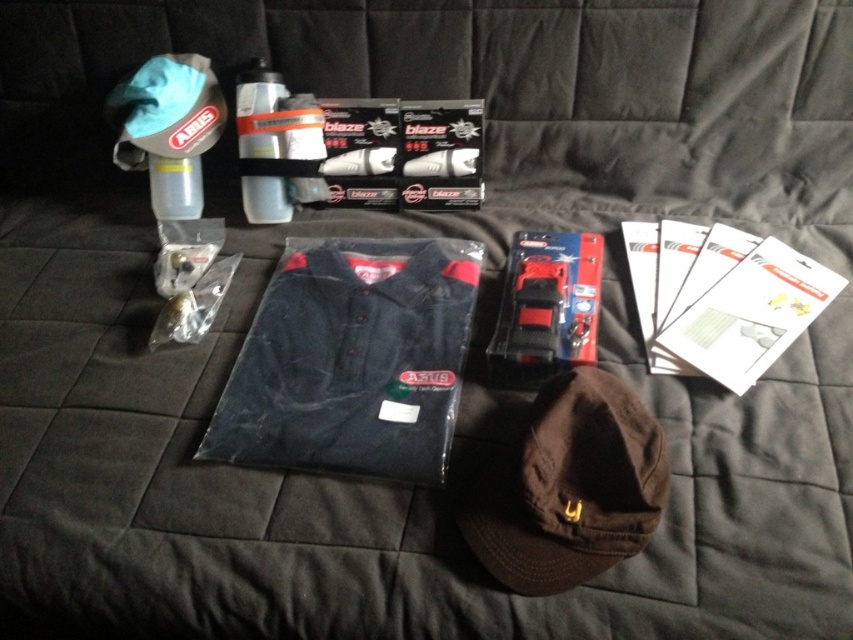
Is point (740, 385) in front of point (265, 145)?

Yes, point (740, 385) is in front of point (265, 145).

Which of these two, white paper at upper right or matte gray water bottle at upper left, stands taller?

matte gray water bottle at upper left is taller.

Between point (732, 380) and point (286, 220), which one is positioned behind?

The point (286, 220) is more distant.

Find the location of a particular element. The image size is (853, 640). white paper at upper right is located at coordinates (751, 314).

Between navy blue fabric at center and matte gray water bottle at upper left, which one is positioned lower?

navy blue fabric at center is lower down.

Is navy blue fabric at center thinner than matte gray water bottle at upper left?

Incorrect, navy blue fabric at center's width is not less than matte gray water bottle at upper left's.

Between point (234, 403) and point (271, 132), which one is positioned behind?

Positioned behind is point (271, 132).

Where is `navy blue fabric at center`? Image resolution: width=853 pixels, height=640 pixels. navy blue fabric at center is located at coordinates (352, 360).

The width and height of the screenshot is (853, 640). What do you see at coordinates (352, 360) in the screenshot?
I see `navy blue fabric at center` at bounding box center [352, 360].

Who is more forward, (329,268) or (538,556)?

Point (538,556) is in front.

Find the location of a particular element. Image resolution: width=853 pixels, height=640 pixels. navy blue fabric at center is located at coordinates (352, 360).